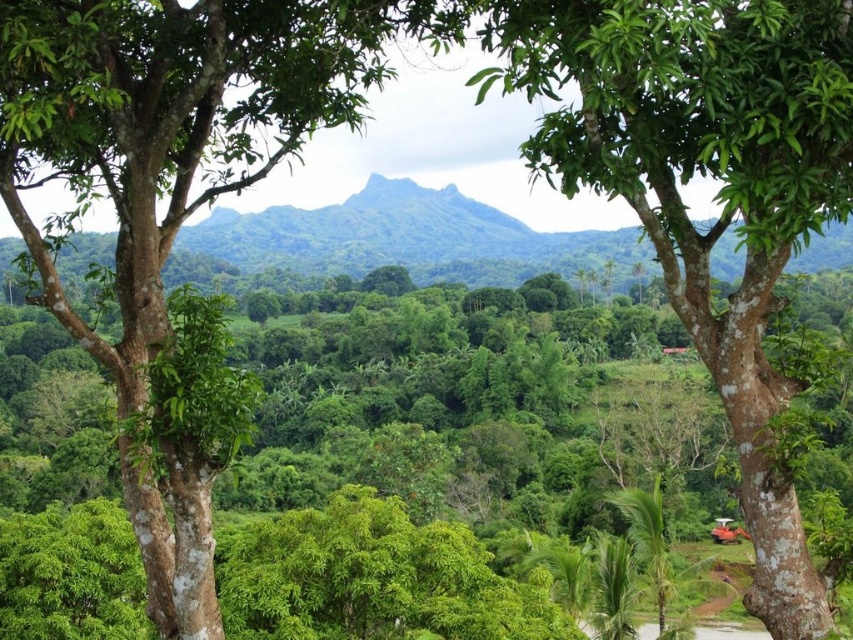
You are a hiker standing in the lush landscape and want to walk from the smooth brown tree trunk at left to the green rough bark tree at center. Which tree will you encounter first?

The smooth brown tree trunk at left is closer to you, so you will encounter it first before reaching the green rough bark tree at center.

You are a hiker carrying a 2.5 meter long ladder. You want to place it between the smooth brown tree trunk at left and the green rough bark tree at center. Will the ladder fit in the space between them?

The smooth brown tree trunk at left is 4.31 meters away from the green rough bark tree at center. Since the ladder is 2.5 meters long, it will fit in the space between them as the distance is greater than the ladder length.

You are standing in the lush landscape and want to walk from the point at coordinates point (297, 81) to the point at coordinates point (698, 266). Which direction should you move to get closer to your destination?

You should move away from the viewer because point (297, 81) is closer to the viewer than point (698, 266). Moving away from the viewer will take you towards the destination.